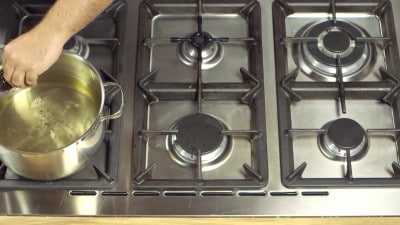
I want to click on pot handle, so click(x=121, y=105).